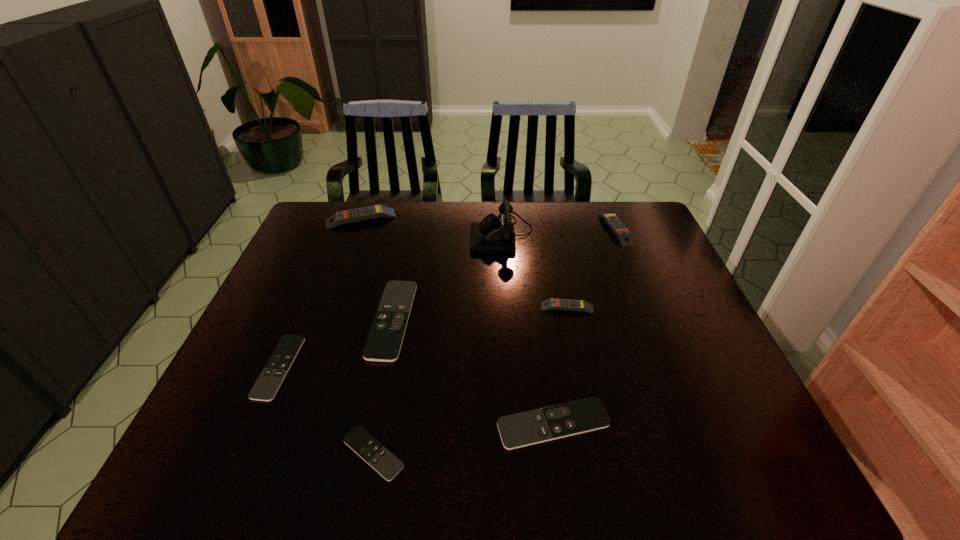
This screenshot has height=540, width=960. I want to click on the fifth tallest remote control, so click(x=518, y=430).

Identify the location of the leftmost black remote control. This screenshot has height=540, width=960. (268, 383).

At what (x,y) coordinates should I click in order to perform the action: click on the second shortest object. Please return your answer as a coordinate pair (x, y). Looking at the image, I should click on (268, 383).

Where is `the smallest black remote control`? The width and height of the screenshot is (960, 540). the smallest black remote control is located at coordinates (361, 442).

You are a GUI agent. You are given a task and a screenshot of the screen. Output one action in this format:
    pyautogui.click(x=<x>, y=<y>)
    Task: Click on the shortest object
    
    Given the screenshot: What is the action you would take?
    pyautogui.click(x=361, y=442)

Locate an element on the screen. vacant area situated 0.100m on the front face of the telephone is located at coordinates coord(441,234).

I want to click on vacant region located 0.360m on the front face of the telephone, so click(x=364, y=234).

This screenshot has width=960, height=540. I want to click on vacant position located on the front face of the telephone, so click(423, 234).

Identify the location of vacant point located 0.250m on the front of the seventh shortest object. The width and height of the screenshot is (960, 540). (340, 277).

At what (x,y) coordinates should I click in order to perform the action: click on vacant position located on the left of the second smallest yellow remote control. Please return your answer as a coordinate pair (x, y). This screenshot has height=540, width=960. Looking at the image, I should click on (544, 229).